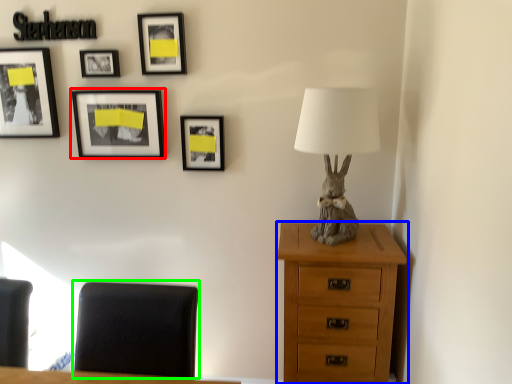
Question: Estimate the real-world distances between objects in this image. Which object is farther from picture frame (highlighted by a red box), chest of drawers (highlighted by a blue box) or furniture (highlighted by a green box)?

Choices:
 (A) chest of drawers
 (B) furniture

Answer: (A)